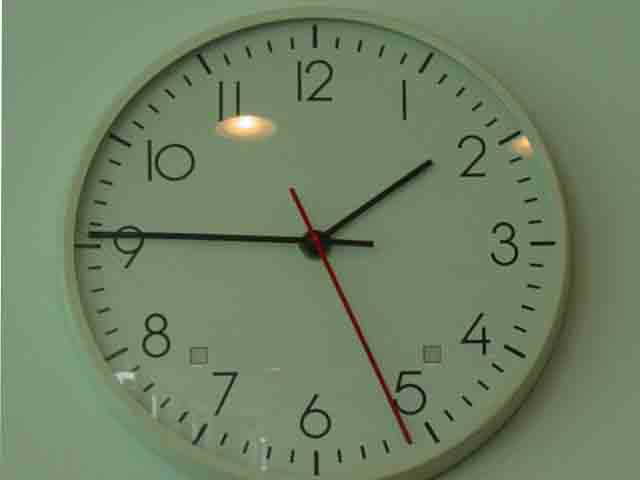
Locate an element on the screen. This screenshot has width=640, height=480. clock hour hand is located at coordinates (427, 164), (371, 202), (322, 236).